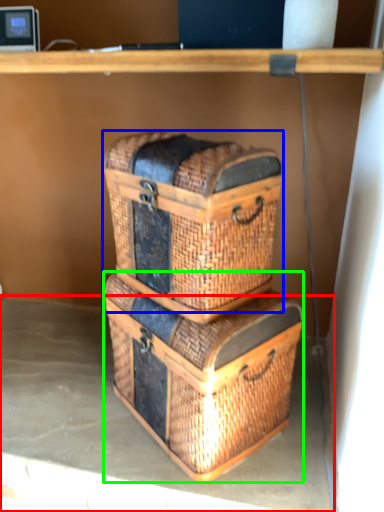
Question: Which object is the closest to the concrete (highlighted by a red box)? Choose among these: basket container (highlighted by a blue box) or crate (highlighted by a green box).

Choices:
 (A) basket container
 (B) crate

Answer: (B)